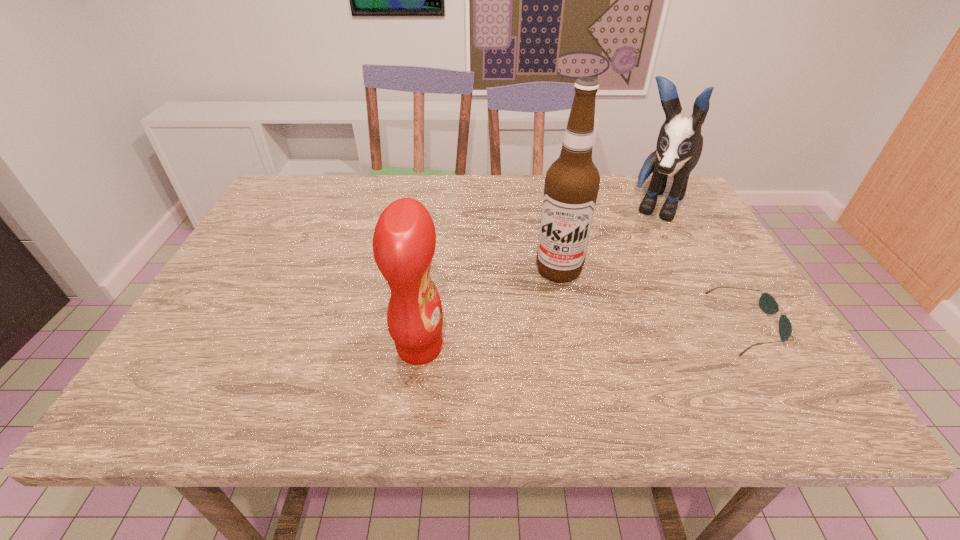
Image resolution: width=960 pixels, height=540 pixels. Identify the location of condiment. (x=404, y=240).

Locate an element on the screen. the leftmost object is located at coordinates (404, 240).

What are the coordinates of `the shortest object` in the screenshot? It's located at (767, 303).

Identify the location of the third shortest object. This screenshot has height=540, width=960. (679, 146).

Where is `puppy`? Image resolution: width=960 pixels, height=540 pixels. puppy is located at coordinates (679, 146).

You are a GUI agent. You are given a task and a screenshot of the screen. Output one action in this format:
    pyautogui.click(x=<x>, y=<y>)
    Task: Click on the second farthest object
    
    Given the screenshot: What is the action you would take?
    pyautogui.click(x=572, y=182)

Locate an element on the screen. the second object from left to right is located at coordinates (572, 182).

You are a GUI agent. You are given a task and a screenshot of the screen. Output one action in this format:
    pyautogui.click(x=<x>, y=<y>)
    Task: Click on the vacant space located 0.140m on the label side of the second shortest object
    The image size is (960, 540).
    Given the screenshot: What is the action you would take?
    pyautogui.click(x=516, y=347)

The image size is (960, 540). I want to click on free space located 0.400m on the front-facing side of the third shortest object, so click(599, 333).

Identify the location of blank space located on the front-facing side of the third shortest object. The width and height of the screenshot is (960, 540). (617, 298).